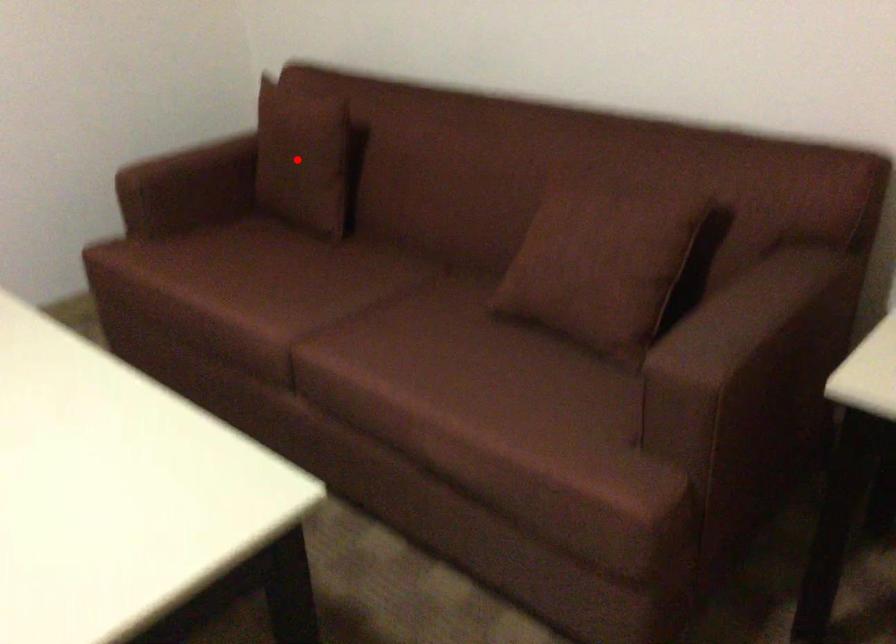
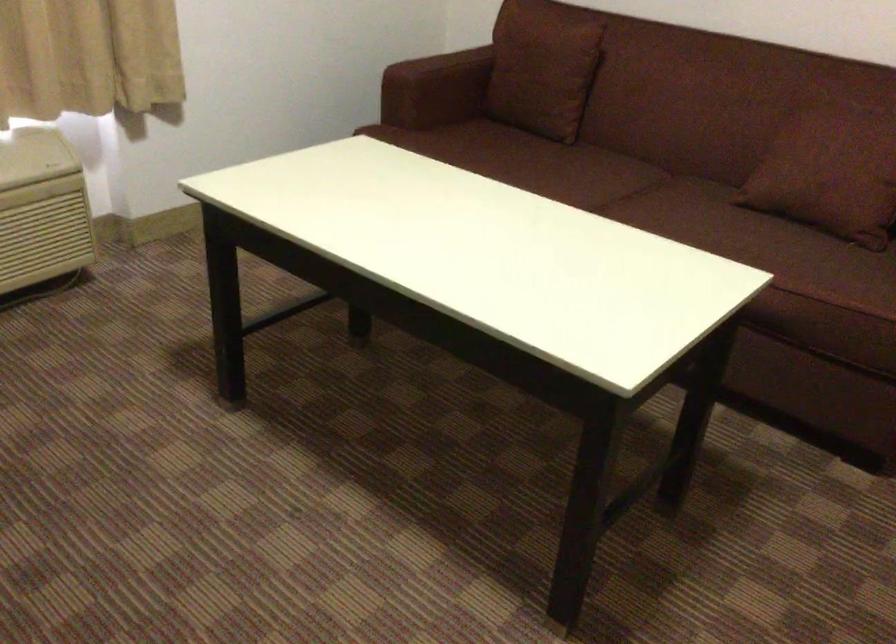
Question: I am providing you with two images of the same scene from different viewpoints. In image1, a red point is highlighted. Considering the same 3D point in image2, which of the following is correct?

Choices:
 (A) It is closer
 (B) It is farther

Answer: (B)